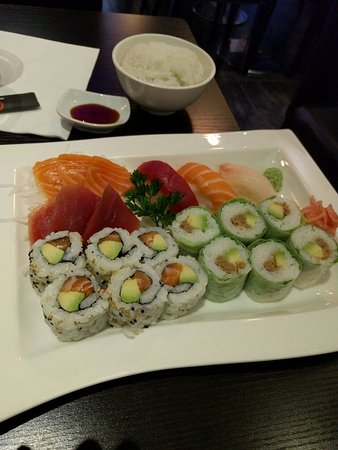
What are the coordinates of `plate` in the screenshot? It's located at (59, 58), (17, 343).